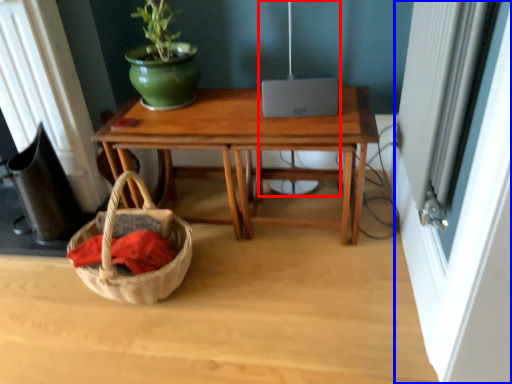
Question: Which point is further to the camera, lamp (highlighted by a red box) or screen door (highlighted by a blue box)?

Choices:
 (A) lamp
 (B) screen door

Answer: (A)